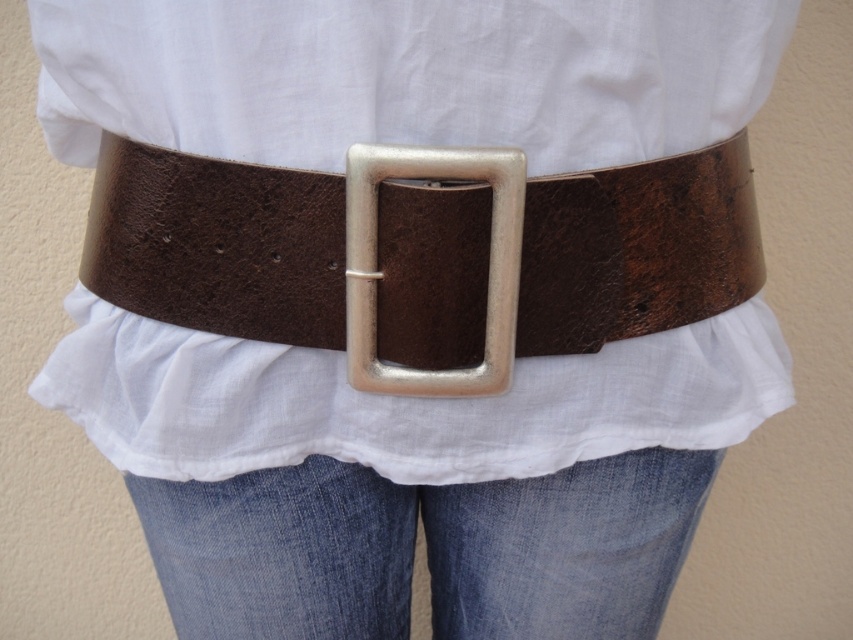
You are a tailor adjusting a customer belt. The customer is wearing a white cotton shirt at center and a metallic silver buckle at center. Can you see the buckle while looking at the front of the shirt?

The white cotton shirt at center is positioned over the metallic silver buckle at center, so the buckle is covered and not visible from the front.

You are a fashion designer looking at this outfit. You need to adjust the length of the denim at center so that it reaches the same height as the metallic silver buckle at center. How should you modify the denim?

The denim at center is currently much taller than the metallic silver buckle at center. To make them the same height, you should shorten the denim at center so that its height matches that of the metallic silver buckle at center.